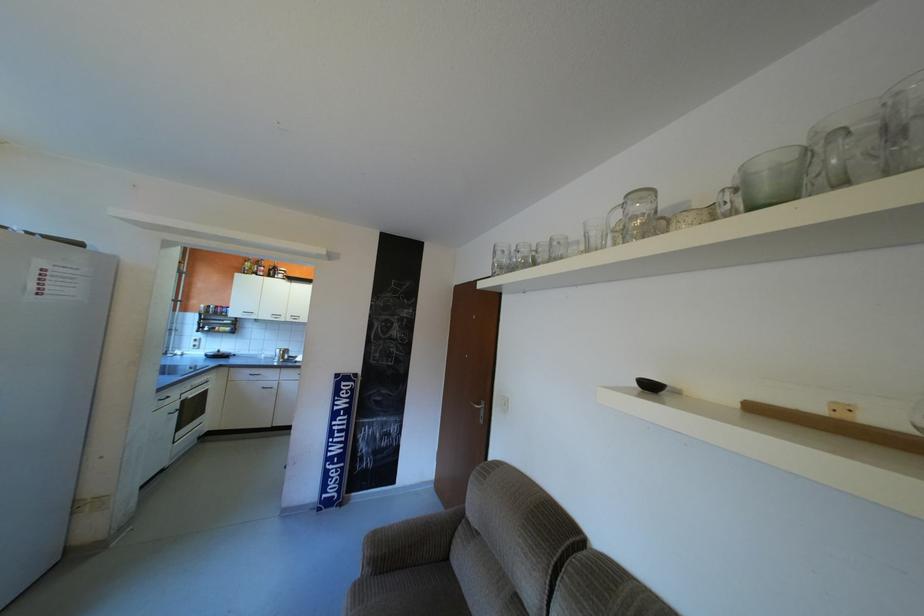
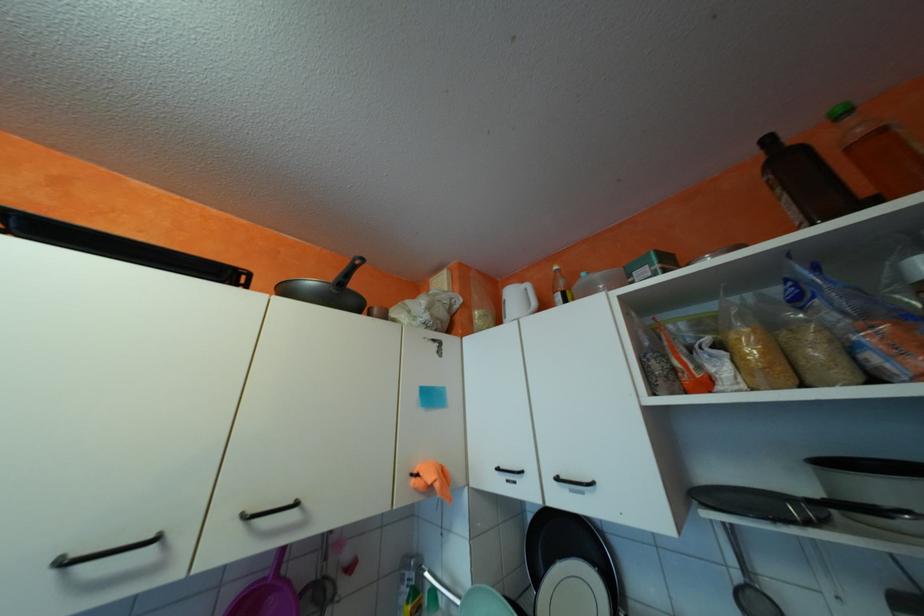
In the scene shown: The images are taken continuously from a first-person perspective. In which direction are you moving?

The cameraman walked toward left, forward.